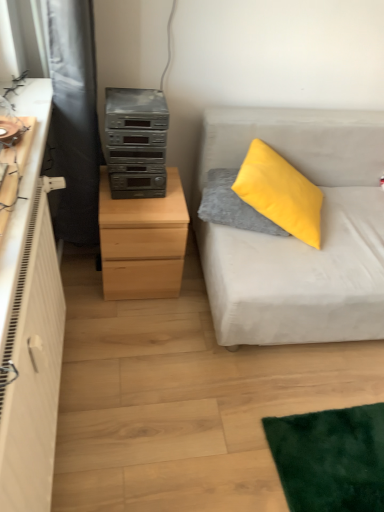
Question: Can you confirm if light wood chest of drawers at left is wider than light gray fabric couch at right?

Choices:
 (A) yes
 (B) no

Answer: (B)

Question: Is light wood chest of drawers at left with light gray fabric couch at right?

Choices:
 (A) no
 (B) yes

Answer: (A)

Question: Is light wood chest of drawers at left taller than light gray fabric couch at right?

Choices:
 (A) no
 (B) yes

Answer: (A)

Question: Does light wood chest of drawers at left lie in front of light gray fabric couch at right?

Choices:
 (A) no
 (B) yes

Answer: (A)

Question: Considering the relative sizes of light wood chest of drawers at left and light gray fabric couch at right in the image provided, is light wood chest of drawers at left shorter than light gray fabric couch at right?

Choices:
 (A) no
 (B) yes

Answer: (B)

Question: Is light wood chest of drawers at left oriented away from light gray fabric couch at right?

Choices:
 (A) no
 (B) yes

Answer: (A)

Question: Is black fabric curtain at left smaller than satin silver stereo at center left?

Choices:
 (A) yes
 (B) no

Answer: (B)

Question: Considering the relative sizes of black fabric curtain at left and satin silver stereo at center left in the image provided, is black fabric curtain at left thinner than satin silver stereo at center left?

Choices:
 (A) yes
 (B) no

Answer: (B)

Question: Is black fabric curtain at left closer to the viewer compared to satin silver stereo at center left?

Choices:
 (A) yes
 (B) no

Answer: (A)

Question: Is black fabric curtain at left placed right next to satin silver stereo at center left?

Choices:
 (A) no
 (B) yes

Answer: (A)

Question: From the image's perspective, does black fabric curtain at left appear lower than satin silver stereo at center left?

Choices:
 (A) no
 (B) yes

Answer: (A)

Question: From a real-world perspective, is black fabric curtain at left beneath satin silver stereo at center left?

Choices:
 (A) yes
 (B) no

Answer: (A)

Question: Does light wood chest of drawers at left appear on the left side of satin silver stereo at center left?

Choices:
 (A) yes
 (B) no

Answer: (A)